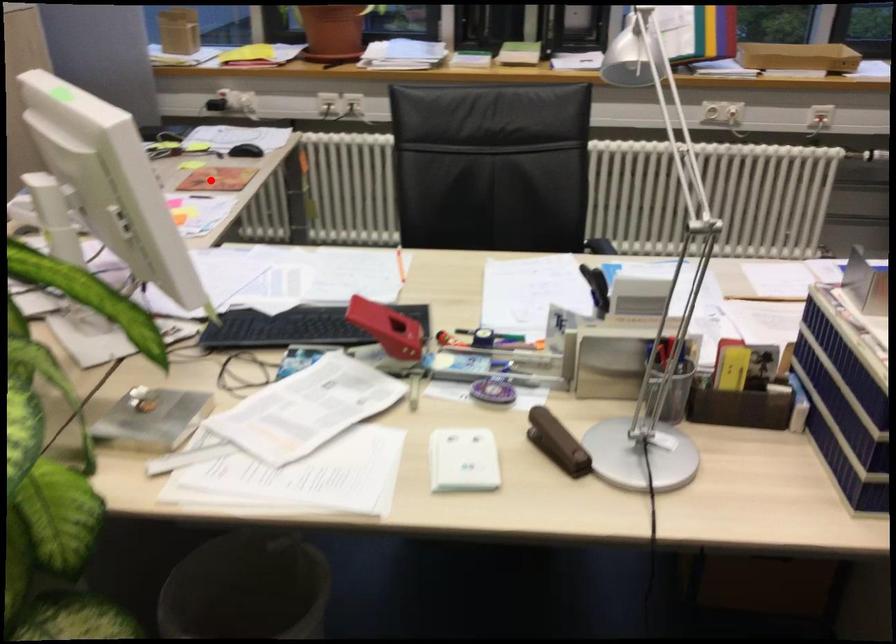
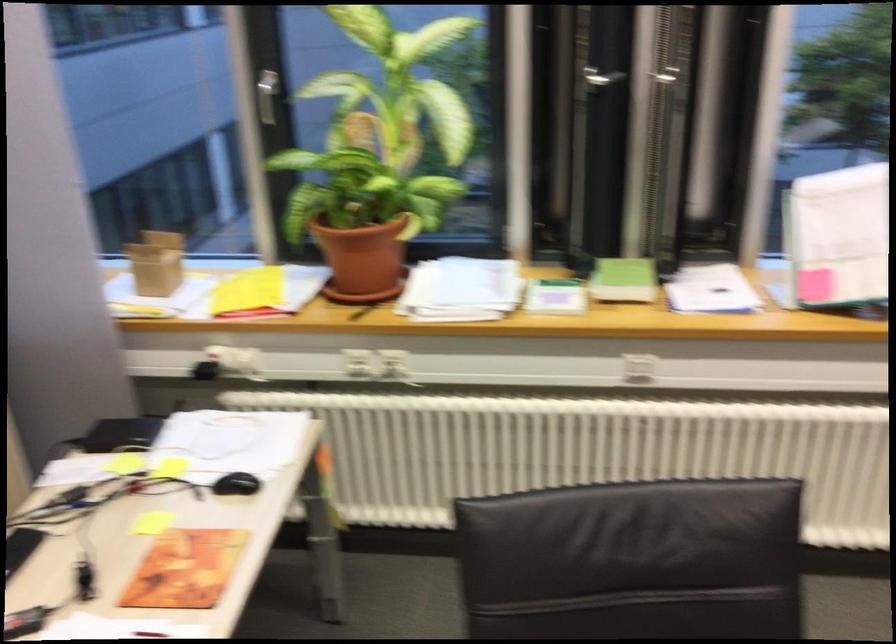
Question: A red point is marked in image1. In image2, is the corresponding 3D point closer to the camera or farther? Reply with the corresponding letter.

Choices:
 (A) The corresponding 3D point is closer.
 (B) The corresponding 3D point is farther.

Answer: (A)